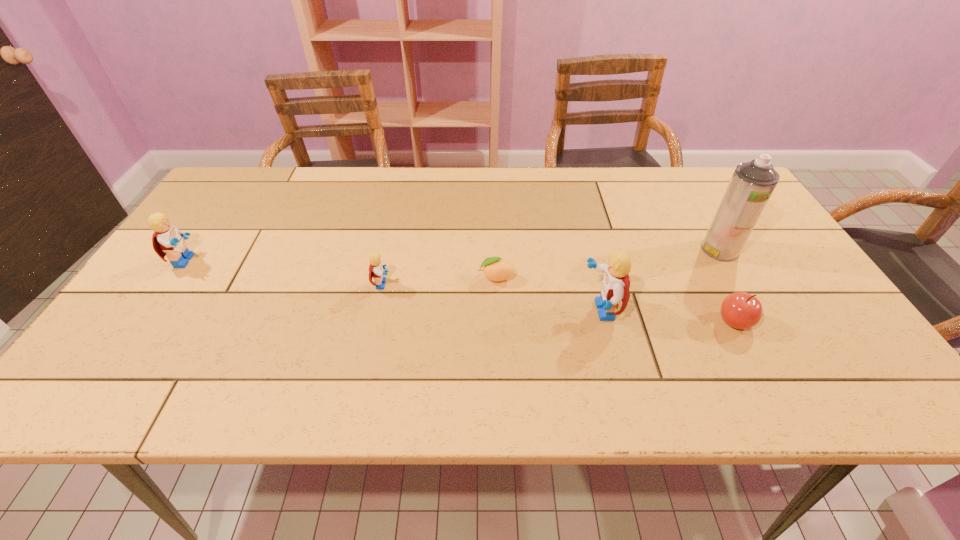
What are the coordinates of `object situated at the near edge` in the screenshot? It's located at (740, 310).

Image resolution: width=960 pixels, height=540 pixels. Find the location of `object located at the left edge`. object located at the left edge is located at coordinates (167, 240).

This screenshot has width=960, height=540. What are the coordinates of `object at the right edge` in the screenshot? It's located at (752, 183).

Identify the location of vacant space at the far edge. coord(443,178).

The height and width of the screenshot is (540, 960). In the image, there is a desktop. Identify the location of free region at the near edge. (712, 338).

The image size is (960, 540). In the image, there is a desktop. What are the coordinates of `vacant space at the left edge` in the screenshot? It's located at (225, 260).

In the image, there is a desktop. Where is `vacant space at the right edge`? vacant space at the right edge is located at coordinates (779, 269).

In the image, there is a desktop. Identify the location of blank space at the far left corner. Image resolution: width=960 pixels, height=540 pixels. (233, 171).

In the image, there is a desktop. Where is `vacant space at the far right corner`? This screenshot has height=540, width=960. vacant space at the far right corner is located at coordinates (706, 174).

The height and width of the screenshot is (540, 960). I want to click on blank region between the shortest object and the aerosol can, so click(608, 264).